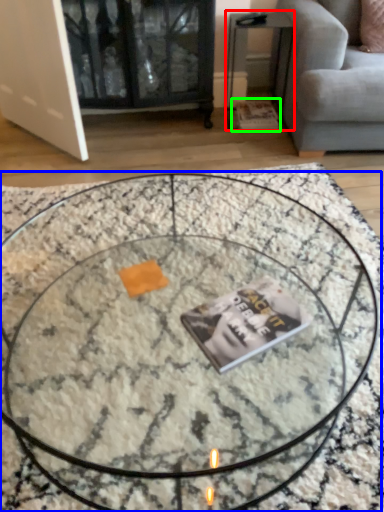
Question: Based on their relative distances, which object is farther from side table (highlighted by a red box)? Choose from coffee table (highlighted by a blue box) and magazine (highlighted by a green box).

Choices:
 (A) coffee table
 (B) magazine

Answer: (A)